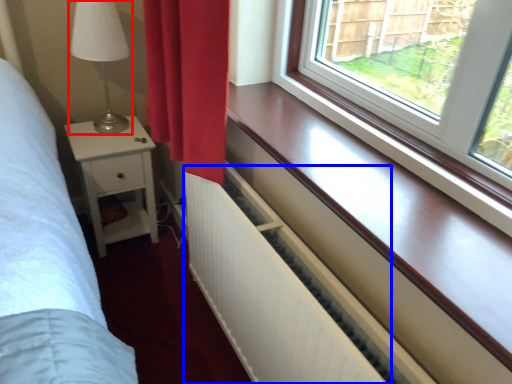
Question: Among these objects, which one is nearest to the camera, table lamp (highlighted by a red box) or radiator (highlighted by a blue box)?

Choices:
 (A) table lamp
 (B) radiator

Answer: (B)